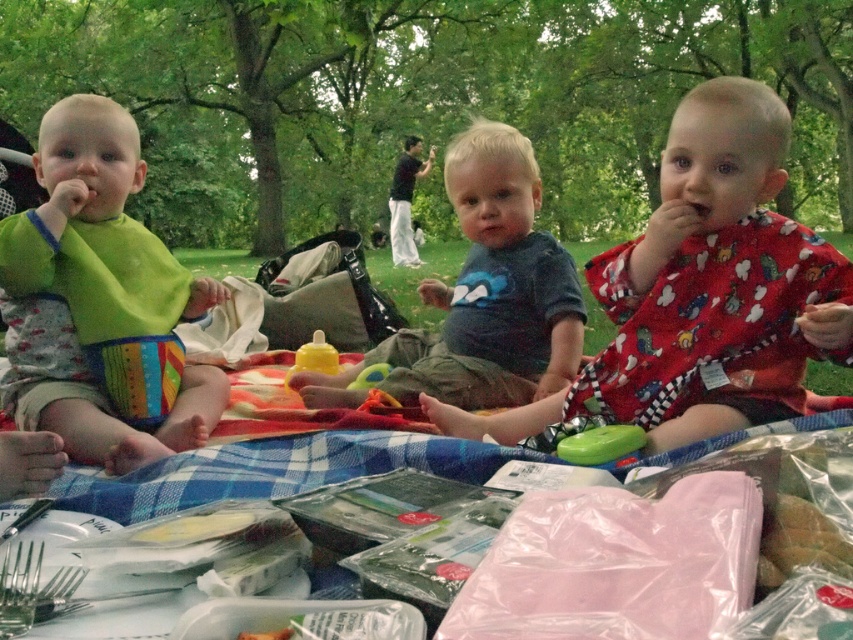
Question: Which point is closer to the camera?

Choices:
 (A) green bibbed baby at left
 (B) green plastic toy at center
 (C) red cotton bib at center
 (D) translucent rubber sippy cup at center

Answer: (C)

Question: In this image, where is blue cotton shirt at center located relative to green plastic toy at center?

Choices:
 (A) above
 (B) below

Answer: (A)

Question: Considering the relative positions of green plastic toy at center and yellow rubbery bottle at center in the image provided, where is green plastic toy at center located with respect to yellow rubbery bottle at center?

Choices:
 (A) right
 (B) left

Answer: (A)

Question: Which is nearer to the red cotton bib at center?

Choices:
 (A) translucent rubber sippy cup at center
 (B) yellow rubbery bottle at center
 (C) blue cotton shirt at center

Answer: (C)

Question: Which object appears closest to the camera in this image?

Choices:
 (A) green bibbed baby at left
 (B) translucent rubber sippy cup at center
 (C) green plastic toy at center
 (D) red cotton bib at center

Answer: (D)

Question: Can you confirm if green plastic toy at center is positioned to the right of yellow rubbery bottle at center?

Choices:
 (A) yes
 (B) no

Answer: (A)